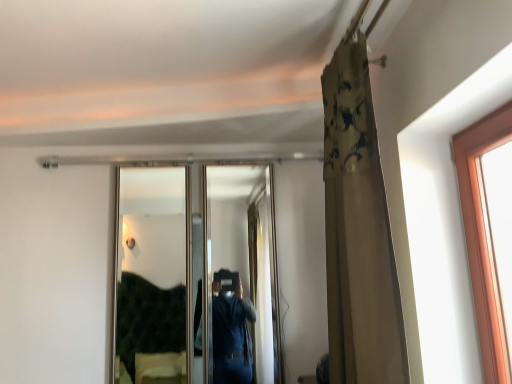
Question: Can clear glass mirror at center be found inside floral fabric curtain at upper right?

Choices:
 (A) no
 (B) yes

Answer: (A)

Question: Could you tell me if floral fabric curtain at upper right is turned towards clear glass mirror at center?

Choices:
 (A) yes
 (B) no

Answer: (B)

Question: From a real-world perspective, is floral fabric curtain at upper right physically above clear glass mirror at center?

Choices:
 (A) yes
 (B) no

Answer: (A)

Question: Is floral fabric curtain at upper right next to clear glass mirror at center and touching it?

Choices:
 (A) yes
 (B) no

Answer: (B)

Question: Is floral fabric curtain at upper right bigger than clear glass mirror at center?

Choices:
 (A) yes
 (B) no

Answer: (A)

Question: Considering the relative positions of floral fabric curtain at upper right and clear glass mirror at center in the image provided, is floral fabric curtain at upper right behind clear glass mirror at center?

Choices:
 (A) yes
 (B) no

Answer: (B)

Question: Is clear glass mirror at center further to the viewer compared to floral fabric curtain at upper right?

Choices:
 (A) no
 (B) yes

Answer: (B)

Question: From the image's perspective, is clear glass mirror at center beneath floral fabric curtain at upper right?

Choices:
 (A) yes
 (B) no

Answer: (A)

Question: Does clear glass mirror at center have a larger size compared to floral fabric curtain at upper right?

Choices:
 (A) yes
 (B) no

Answer: (B)

Question: From the image's perspective, is clear glass mirror at center over floral fabric curtain at upper right?

Choices:
 (A) no
 (B) yes

Answer: (A)

Question: Is clear glass mirror at center not within floral fabric curtain at upper right?

Choices:
 (A) yes
 (B) no

Answer: (A)

Question: Are clear glass mirror at center and floral fabric curtain at upper right making contact?

Choices:
 (A) yes
 (B) no

Answer: (B)

Question: Is point (219, 327) positioned closer to the camera than point (359, 132)?

Choices:
 (A) farther
 (B) closer

Answer: (A)